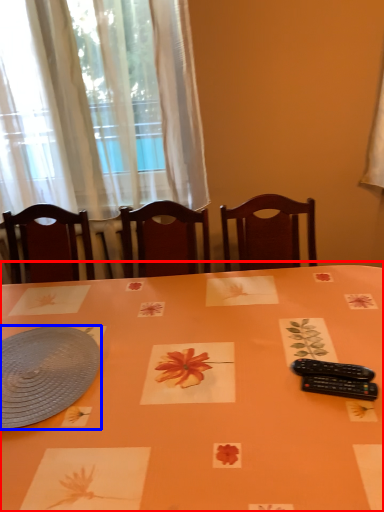
Question: Which object appears farthest to the camera in this image, table (highlighted by a red box) or platter (highlighted by a blue box)?

Choices:
 (A) table
 (B) platter

Answer: (B)